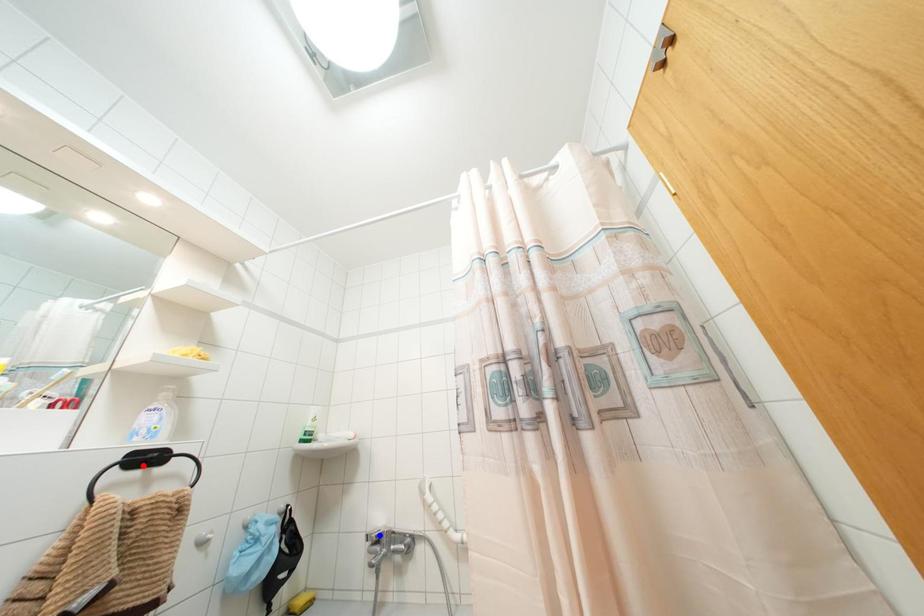
Question: Two points are marked on the image. Which point is closer to the camera?

Choices:
 (A) Blue point is closer.
 (B) Red point is closer.

Answer: (B)